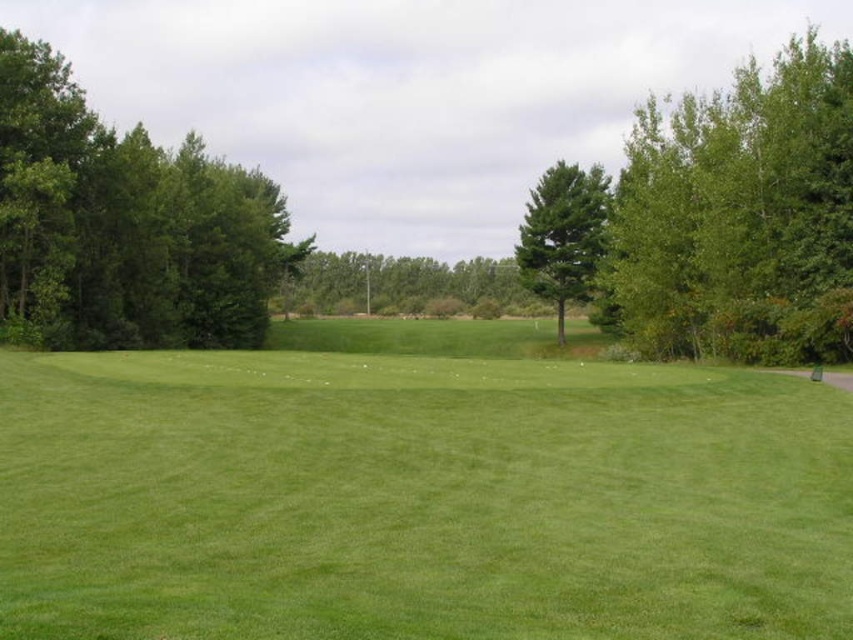
Question: Can you confirm if green leafy tree at upper right is positioned to the right of green leafy tree at left?

Choices:
 (A) yes
 (B) no

Answer: (A)

Question: Which point is closer to the camera taking this photo?

Choices:
 (A) (276, 611)
 (B) (560, 161)
 (C) (177, 179)

Answer: (A)

Question: Is green leafy tree at upper right smaller than green textured tree at center?

Choices:
 (A) no
 (B) yes

Answer: (A)

Question: Does green grassy field at center lie behind green leafy tree at upper right?

Choices:
 (A) yes
 (B) no

Answer: (B)

Question: Which object is the closest to the green leafy tree at upper right?

Choices:
 (A) green leafy tree at center
 (B) green textured tree at center
 (C) green leafy tree at left
 (D) green grassy field at center

Answer: (D)

Question: Estimate the real-world distances between objects in this image. Which object is farther from the green leafy tree at left?

Choices:
 (A) green leafy tree at upper right
 (B) green textured tree at center
 (C) green leafy tree at center
 (D) green grassy field at center

Answer: (C)